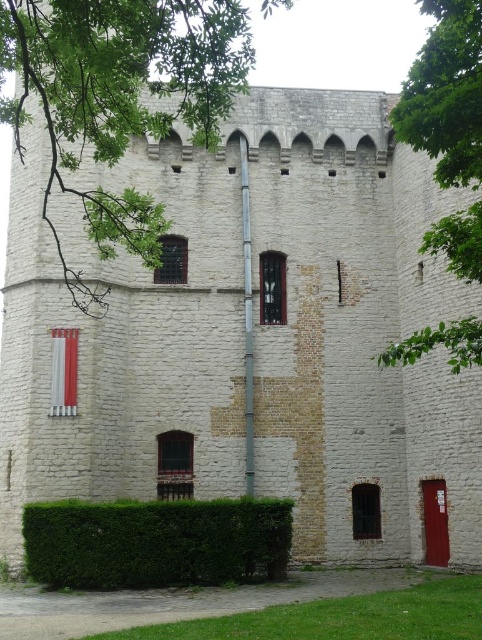
You are standing in front of the historic stone tower and see two points marked on its facade. The first point is at coordinates point (70,170) and the second is at point (240,547). Which point is closer to you?

Point (70,170) is further to the camera than point (240,547), so the point closer to you is point (240,547).

You are standing at the base of the historic stone tower and want to plant a new flower bed between the green leafy tree at upper left and the green leafy hedge at lower left. The flower bed requires a minimum distance of 50 feet between the tree and hedge to thrive. Based on the scene, will the existing spacing between these two plants allow the flower bed to grow properly?

The green leafy tree at upper left is 57.24 feet away from the green leafy hedge at lower left. Since 57.24 feet exceeds the required 50 feet minimum distance, the flower bed should have sufficient space to thrive between them.